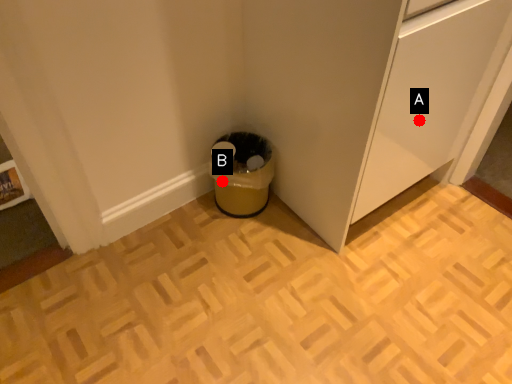
Question: Two points are circled on the image, labeled by A and B beside each circle. Which point is farther to the camera?

Choices:
 (A) A is further
 (B) B is further

Answer: (B)